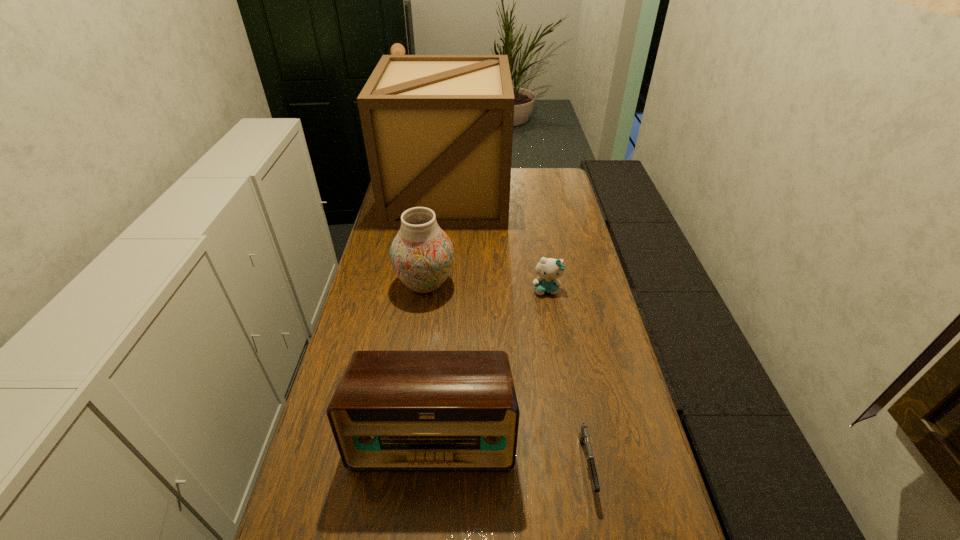
Where is `object at the far edge`? The image size is (960, 540). object at the far edge is located at coordinates (438, 129).

In order to click on box that is positioned at the left edge in this screenshot , I will do `click(438, 129)`.

Image resolution: width=960 pixels, height=540 pixels. Find the location of `vase that is positioned at the left edge`. vase that is positioned at the left edge is located at coordinates (421, 254).

The height and width of the screenshot is (540, 960). What are the coordinates of `radio receiver at the left edge` in the screenshot? It's located at (392, 410).

You are a GUI agent. You are given a task and a screenshot of the screen. Output one action in this format:
    pyautogui.click(x=<x>, y=<y>)
    Task: Click on the kitten situated at the right edge
    Image resolution: width=960 pixels, height=540 pixels.
    Given the screenshot: What is the action you would take?
    pyautogui.click(x=548, y=269)

Where is `gun that is at the right edge`? gun that is at the right edge is located at coordinates (584, 436).

In order to click on object that is positioned at the far left corner in this screenshot , I will do `click(438, 129)`.

In the image, there is a desktop. At what (x,y) coordinates should I click in order to perform the action: click on free space at the far edge. Please return your answer as a coordinate pair (x, y). The height and width of the screenshot is (540, 960). Looking at the image, I should click on (525, 193).

Where is `free space at the left edge`? free space at the left edge is located at coordinates (367, 306).

This screenshot has height=540, width=960. What are the coordinates of `free region at the right edge of the desktop` in the screenshot? It's located at (564, 356).